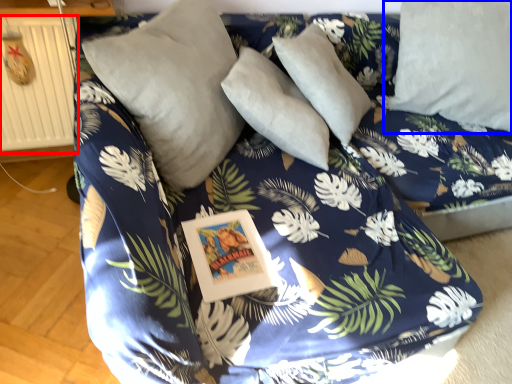
Question: Among these objects, which one is nearest to the camera, radiator (highlighted by a red box) or pillow (highlighted by a blue box)?

Choices:
 (A) radiator
 (B) pillow

Answer: (A)